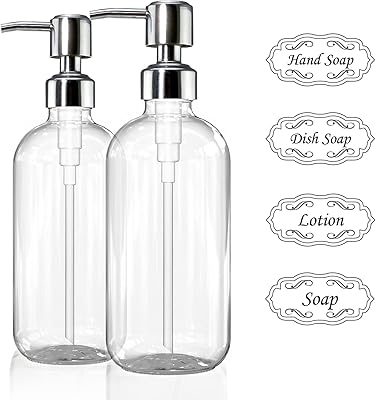
Identify the location of pump bottles. (43, 271), (148, 292).